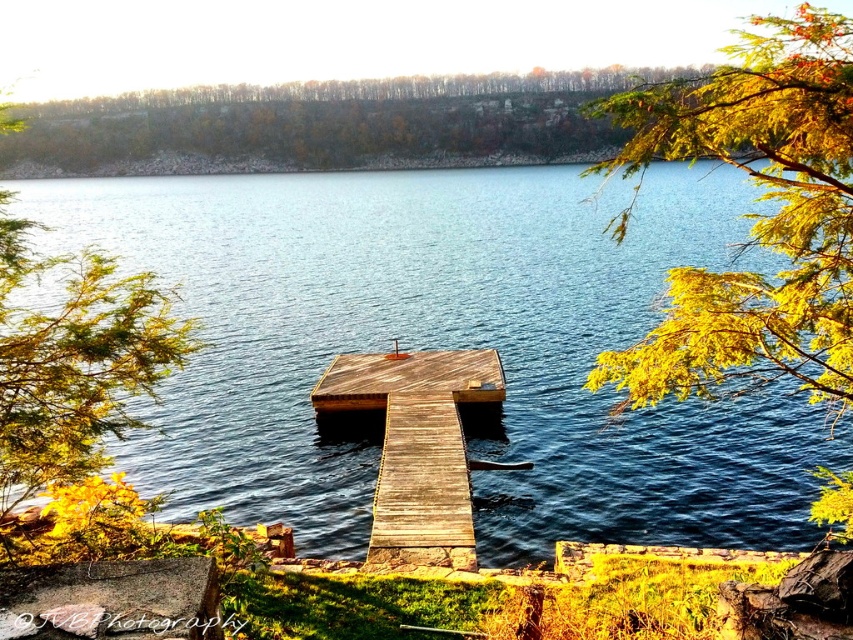
You are standing at the point marked by coordinates point (753, 216). Looking towards the wooden dock extending into the lake, which direction should you walk to reach the dock?

The yellow green leaves at upper right is represented by point (753, 216). Therefore, to reach the wooden dock extending into the lake, you should walk downward from point (753, 216) since the dock is located at lower positions in the image.

You are standing at the edge of the lake and want to take a photo of two specific points in the scene. The first point is at coordinates point (x=843, y=26), and the second is at point (x=151, y=316). Which point will appear larger in your photo?

Point (x=843, y=26) will appear larger in the photo because it is closer to the camera than point (x=151, y=316).